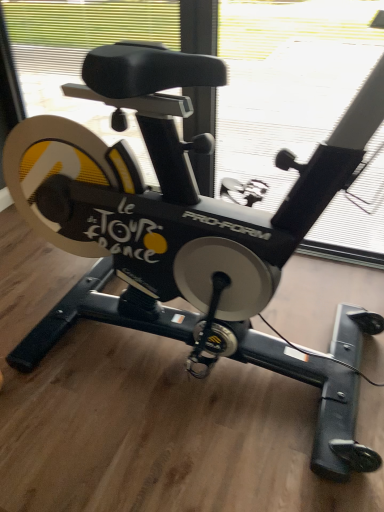
Question: Is point (311, 252) positioned closer to the camera than point (367, 22)?

Choices:
 (A) closer
 (B) farther

Answer: (B)

Question: From their relative heights in the image, would you say transparent plastic window screen at upper center, the first window screen from the front, is taller or shorter than transparent plastic window screen at upper center, which ranks as the first window screen in back-to-front order?

Choices:
 (A) short
 (B) tall

Answer: (B)

Question: From a real-world perspective, is transparent plastic window screen at upper center, placed as the second window screen when sorted from back to front, above or below transparent plastic window screen at upper center, the second window screen from the front?

Choices:
 (A) below
 (B) above

Answer: (B)

Question: Considering the relative positions of transparent plastic window screen at upper center, which ranks as the first window screen in back-to-front order, and transparent plastic window screen at upper center, placed as the second window screen when sorted from back to front, in the image provided, is transparent plastic window screen at upper center, which ranks as the first window screen in back-to-front order, to the left or to the right of transparent plastic window screen at upper center, placed as the second window screen when sorted from back to front,?

Choices:
 (A) right
 (B) left

Answer: (A)

Question: Is transparent plastic window screen at upper center, which ranks as the first window screen in back-to-front order, in front of or behind transparent plastic window screen at upper center, placed as the second window screen when sorted from back to front, in the image?

Choices:
 (A) behind
 (B) front

Answer: (A)

Question: From the image's perspective, is transparent plastic window screen at upper center, which ranks as the first window screen in back-to-front order, above or below transparent plastic window screen at upper center, the first window screen from the front?

Choices:
 (A) above
 (B) below

Answer: (A)

Question: Considering the positions of transparent plastic window screen at upper center, which ranks as the first window screen in back-to-front order, and transparent plastic window screen at upper center, the first window screen from the front, in the image, is transparent plastic window screen at upper center, which ranks as the first window screen in back-to-front order, bigger or smaller than transparent plastic window screen at upper center, the first window screen from the front,?

Choices:
 (A) small
 (B) big

Answer: (A)